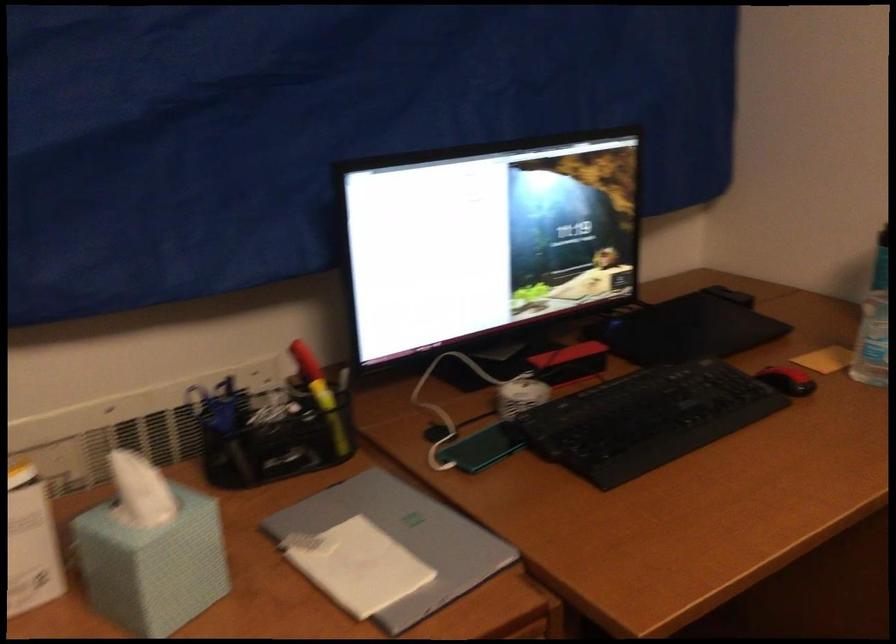
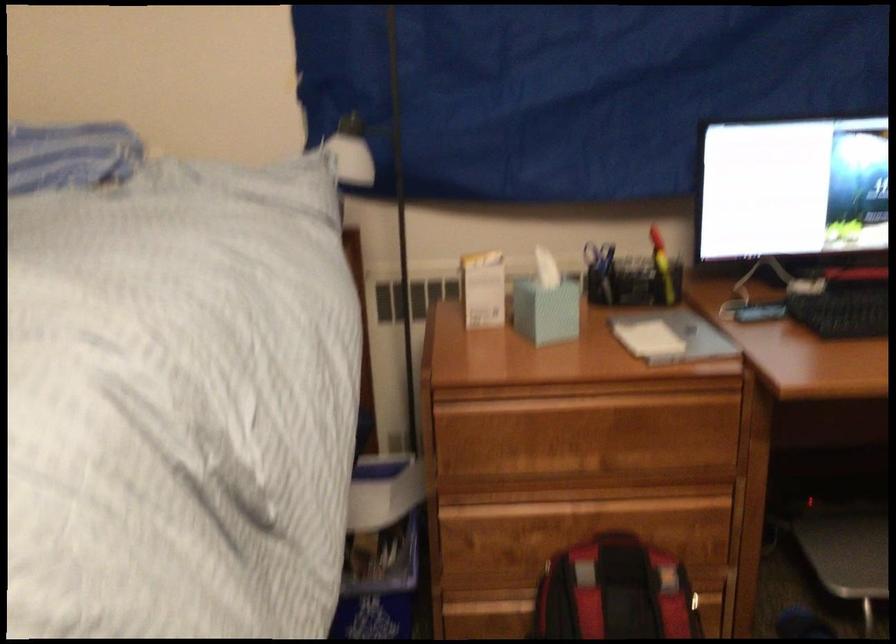
Locate, in the second image, the point that corresponds to point (227, 429) in the first image.

(599, 272)